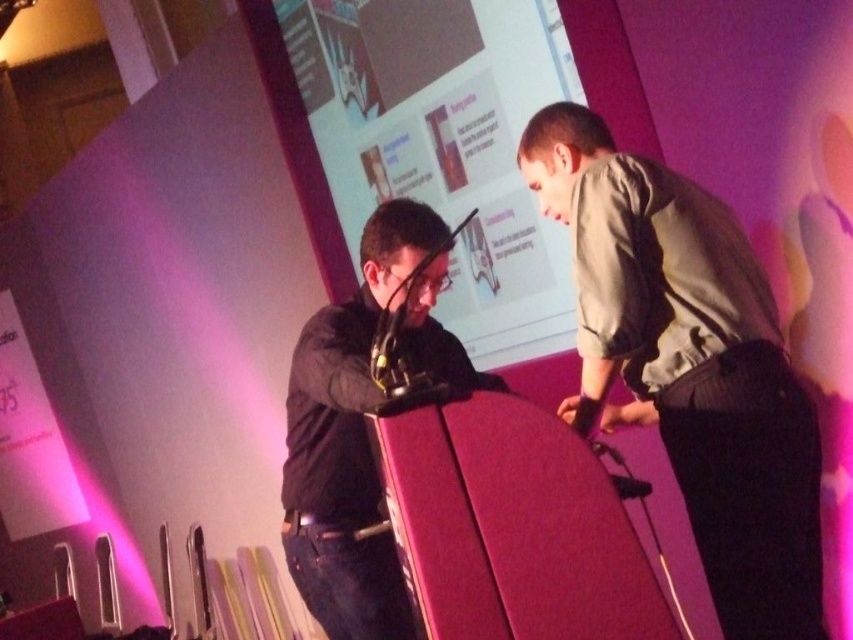
Question: Can you confirm if light gray fabric shirt at right is smaller than black matte jacket at center?

Choices:
 (A) yes
 (B) no

Answer: (A)

Question: Can you confirm if light gray fabric shirt at right is positioned to the right of black matte jacket at center?

Choices:
 (A) no
 (B) yes

Answer: (B)

Question: Can you confirm if light gray fabric shirt at right is positioned to the right of black matte jacket at center?

Choices:
 (A) no
 (B) yes

Answer: (B)

Question: Which object is farther from the camera taking this photo?

Choices:
 (A) light gray fabric shirt at right
 (B) black matte jacket at center

Answer: (A)

Question: Which object is closer to the camera taking this photo?

Choices:
 (A) black matte jacket at center
 (B) light gray fabric shirt at right

Answer: (A)

Question: Among these objects, which one is farthest from the camera?

Choices:
 (A) light gray fabric shirt at right
 (B) black matte jacket at center

Answer: (A)